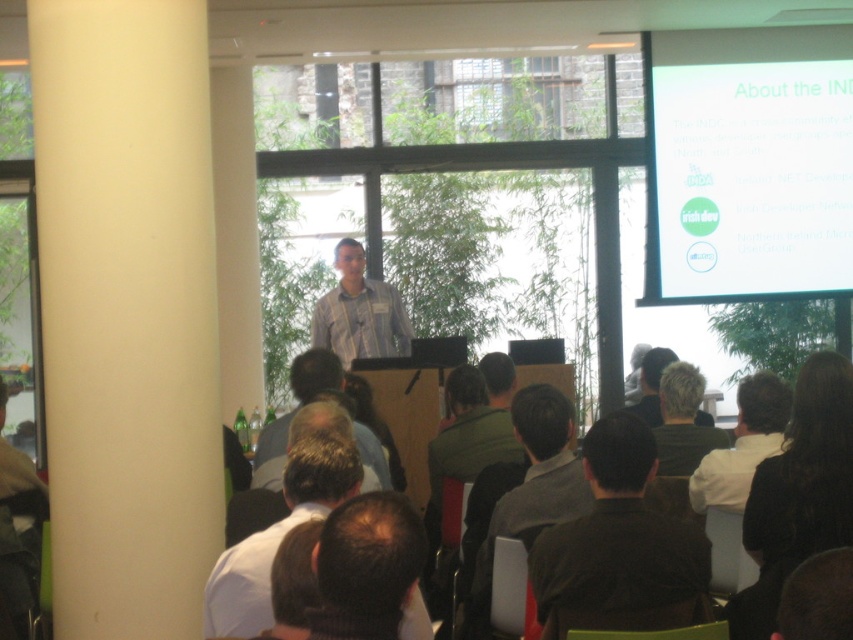
Question: Is white matte projection screen at upper right below dark gray fabric shirt at center?

Choices:
 (A) yes
 (B) no

Answer: (B)

Question: Considering the real-world distances, which object is closest to the dark gray fabric shirt at center?

Choices:
 (A) dark brown hair at center
 (B) blonde hair at center
 (C) dark brown hair at upper right

Answer: (A)

Question: Does dark brown leather jacket at center lie in front of blonde hair at center?

Choices:
 (A) yes
 (B) no

Answer: (A)

Question: Is dark gray fabric shirt at center smaller than white shirt at center?

Choices:
 (A) yes
 (B) no

Answer: (B)

Question: Which point is closer to the camera?

Choices:
 (A) white matte projection screen at upper right
 (B) dark gray fabric shirt at center
 (C) blonde hair at center

Answer: (B)

Question: Among these objects, which one is nearest to the camera?

Choices:
 (A) dark brown hair at center
 (B) white shirt at center

Answer: (B)